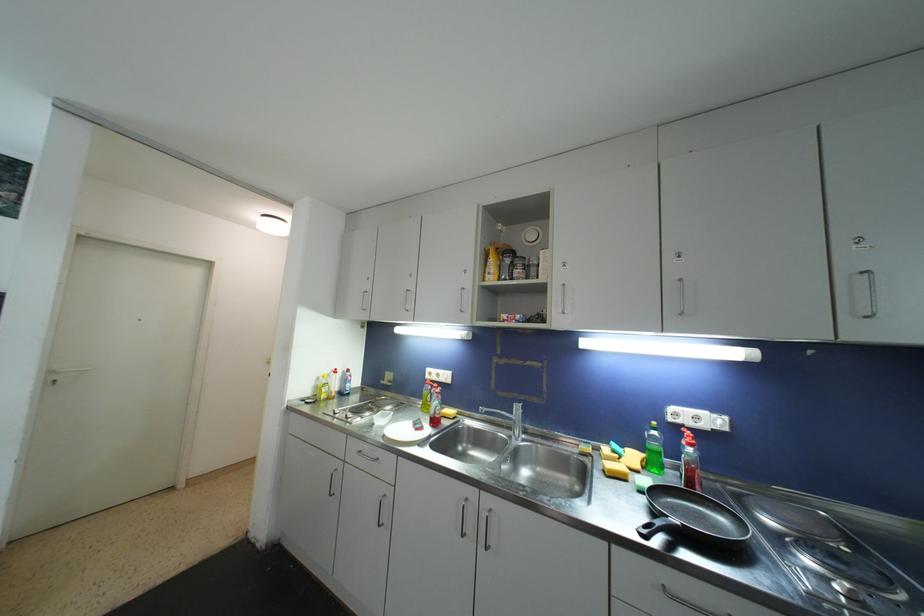
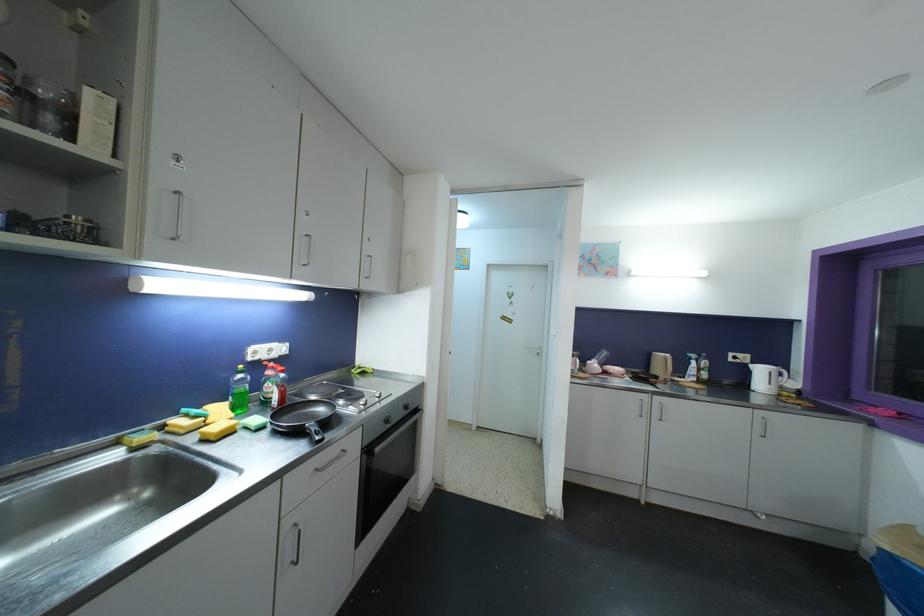
Locate, in the second image, the point that corresponds to the point at 616,455 in the first image.

(199, 419)